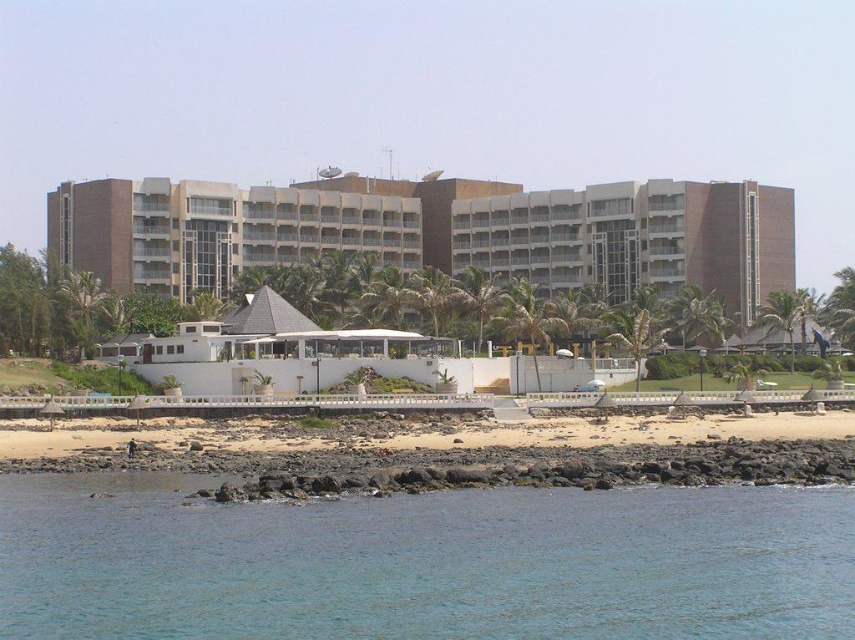
Question: Which object is farther from the camera taking this photo?

Choices:
 (A) brown concrete building at center
 (B) clear blue water at lower center

Answer: (A)

Question: Can you confirm if brown concrete building at center is bigger than brown sand at lower center?

Choices:
 (A) no
 (B) yes

Answer: (B)

Question: Considering the relative positions of clear blue water at lower center and brown sand at lower center in the image provided, where is clear blue water at lower center located with respect to brown sand at lower center?

Choices:
 (A) left
 (B) right

Answer: (A)

Question: Does clear blue water at lower center lie behind brown sand at lower center?

Choices:
 (A) no
 (B) yes

Answer: (A)

Question: Which of the following is the farthest from the observer?

Choices:
 (A) brown sand at lower center
 (B) clear blue water at lower center

Answer: (A)

Question: Among these objects, which one is nearest to the camera?

Choices:
 (A) brown concrete building at center
 (B) clear blue water at lower center

Answer: (B)